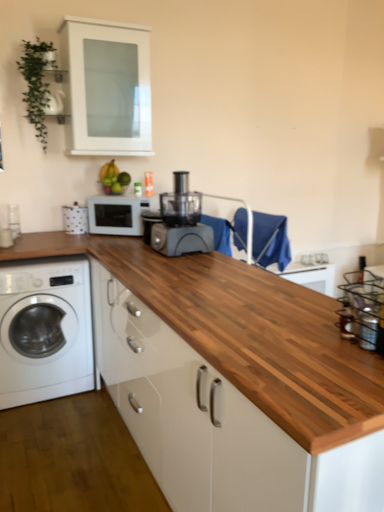
This screenshot has height=512, width=384. I want to click on free space in front of white matte microwave at center, so click(105, 241).